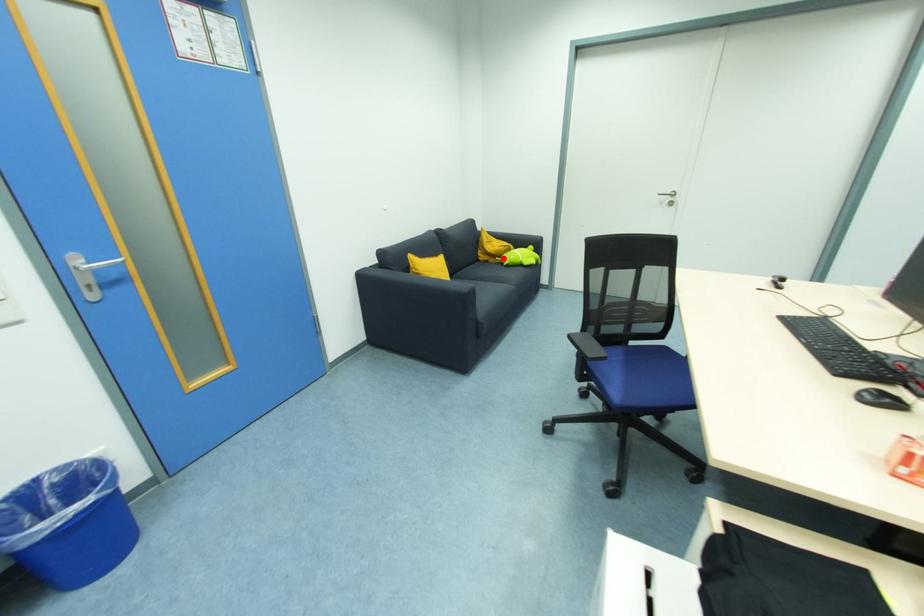
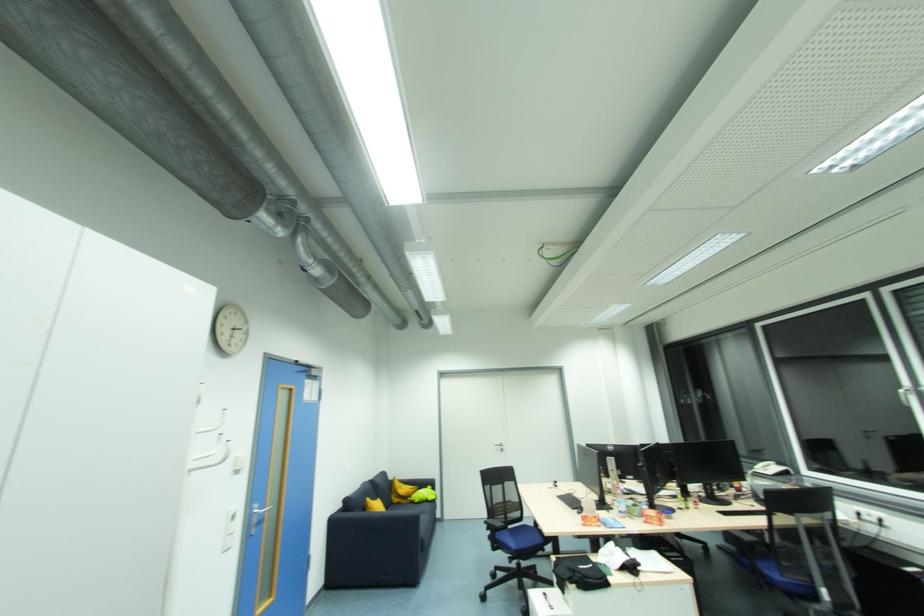
The point at the highlighted location is marked in the first image. Where is the corresponding point in the second image?

(412, 499)